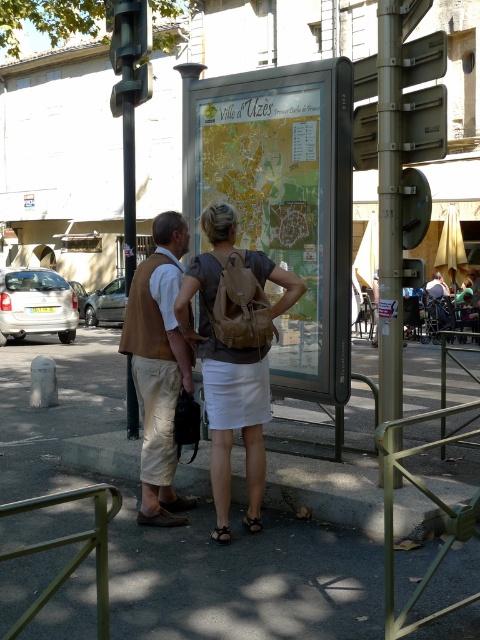
Question: Which of the following is the farthest from the observer?

Choices:
 (A) (172, 369)
 (B) (207, 369)
 (C) (388, 362)

Answer: (A)

Question: Can you confirm if gray asphalt pavement at center is positioned above brown backpack at center?

Choices:
 (A) no
 (B) yes

Answer: (A)

Question: Is gray asphalt pavement at center wider than gold metallic pole at right?

Choices:
 (A) yes
 (B) no

Answer: (A)

Question: Considering the real-world distances, which object is closest to the brown leather vest at left?

Choices:
 (A) gold metallic pole at right
 (B) gray asphalt pavement at center
 (C) brown backpack at center
 (D) metallic silver sign at upper right

Answer: (C)

Question: From the image, what is the correct spatial relationship of gray asphalt pavement at center in relation to brown leather vest at left?

Choices:
 (A) right
 (B) left

Answer: (B)

Question: Which point is closer to the camera?

Choices:
 (A) (362, 61)
 (B) (394, 336)
 (C) (327, 616)
 (D) (235, 262)

Answer: (C)